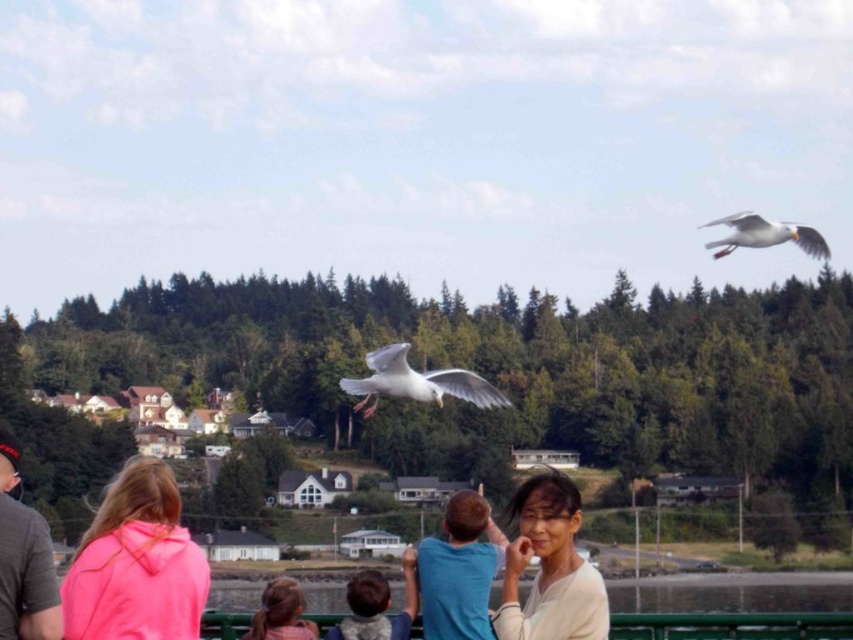
Question: Does blue cotton shirt at center have a smaller size compared to white feathered bird at center?

Choices:
 (A) yes
 (B) no

Answer: (A)

Question: Is pink fleece jacket at lower left to the left of light brown hair at lower center from the viewer's perspective?

Choices:
 (A) yes
 (B) no

Answer: (A)

Question: Among these objects, which one is nearest to the camera?

Choices:
 (A) white feathered bird at center
 (B) smooth beige blouse at center
 (C) light brown hair at lower center
 (D) pink fabric at lower left

Answer: (D)

Question: Which point is farther from the camera taking this photo?

Choices:
 (A) (280, 580)
 (B) (457, 394)
 (C) (770, 237)
 (D) (350, 630)

Answer: (C)

Question: Is white feathered bird at upper right closer to camera compared to pink fleece jacket at lower center?

Choices:
 (A) no
 (B) yes

Answer: (A)

Question: Which point is farther to the camera?

Choices:
 (A) light brown hair at lower center
 (B) smooth beige blouse at center

Answer: (A)